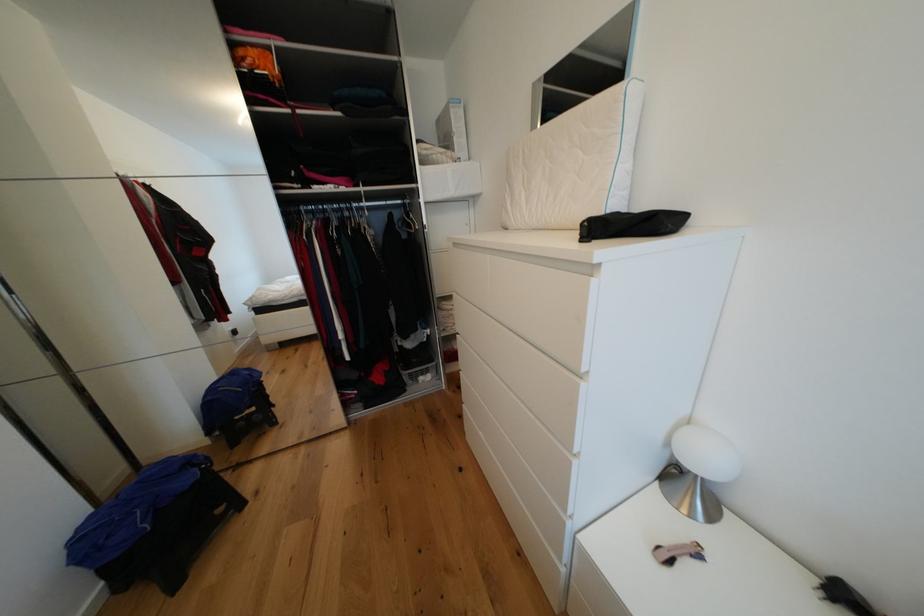
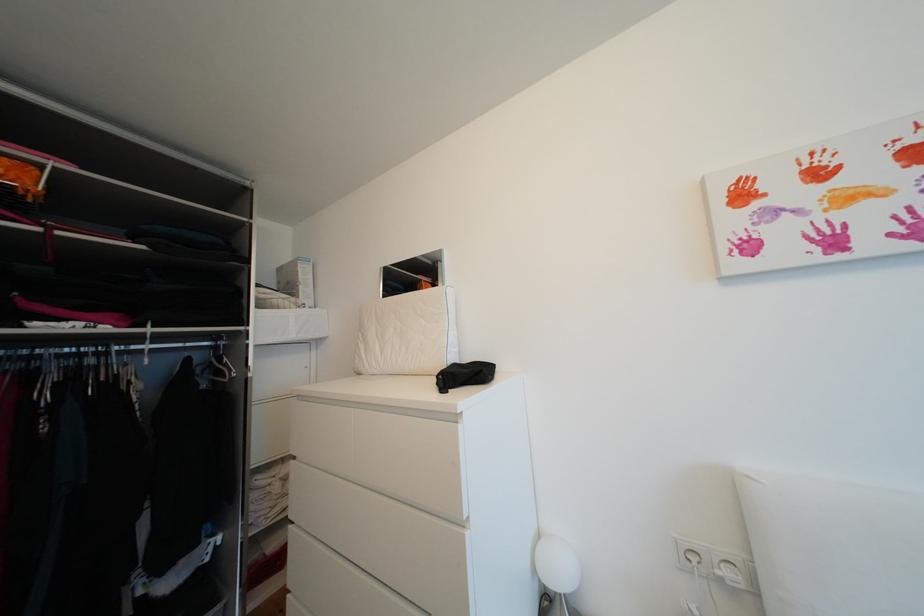
Locate, in the second image, the point that corresponds to point 696,423 in the first image.

(545, 537)